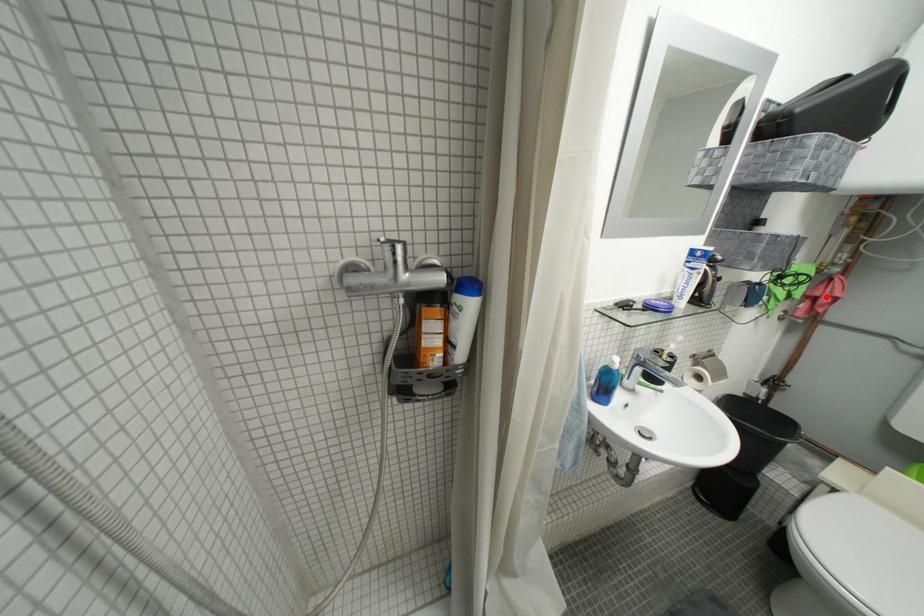
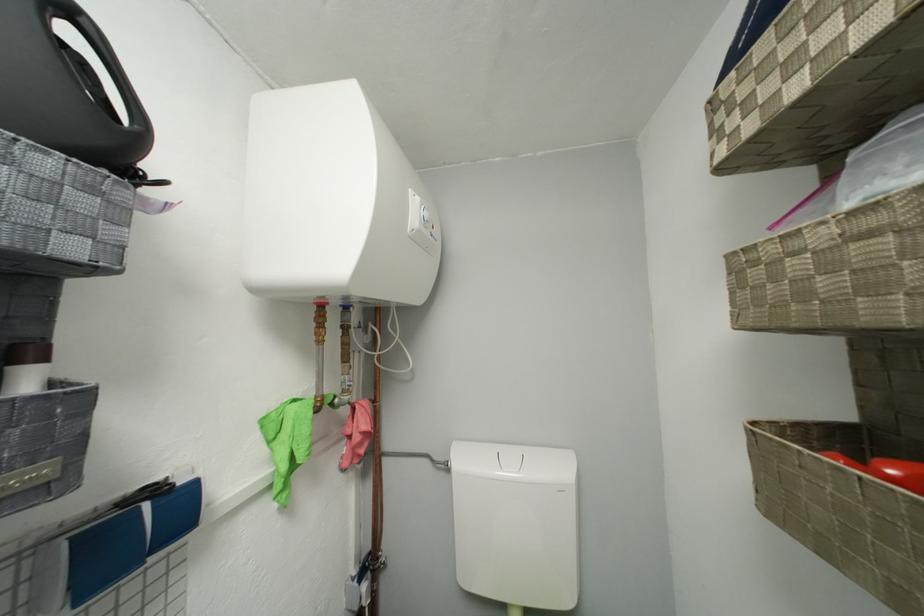
Find the pixel in the second image that matches the highlighted location in the first image.

(358, 435)